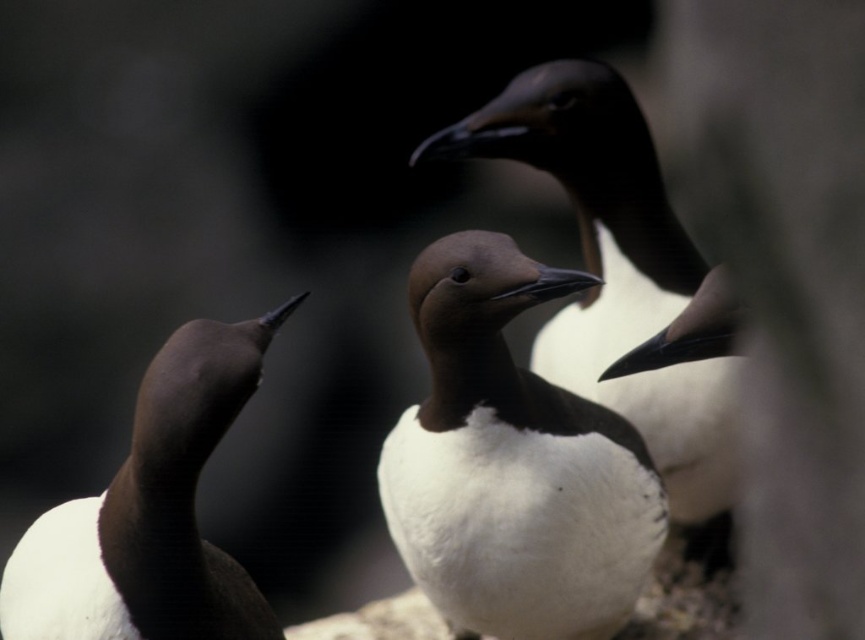
You are a wildlife photographer aiming to capture a closeup shot of the white matte penguin at center and the brown matte penguin at left. Given that your camera can only focus on one subject at a time, which penguin should you focus on to ensure the larger bird is in sharp detail?

The white matte penguin at center is larger than the brown matte penguin at left, so you should focus on the white matte penguin at center to ensure the larger bird is in sharp detail.